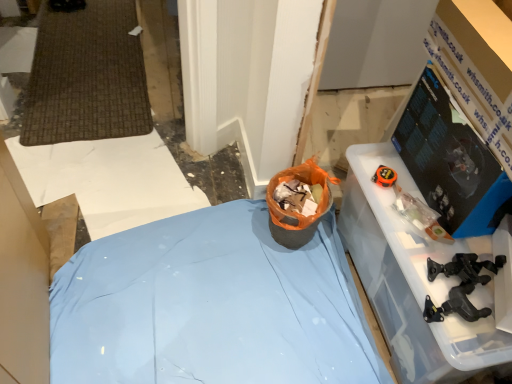
What is the approximate width of blue fabric bed at center, arranged as the first furniture when viewed from the left?

36.04 inches.

You are a GUI agent. You are given a task and a screenshot of the screen. Output one action in this format:
    pyautogui.click(x=<x>, y=<y>)
    Task: Click on the orange fabric bag at center
    This screenshot has height=384, width=512.
    Given the screenshot: What is the action you would take?
    pyautogui.click(x=294, y=212)

This screenshot has width=512, height=384. What do you see at coordinates (449, 161) in the screenshot? I see `black glossy monitor at upper right` at bounding box center [449, 161].

Locate an element on the screen. The height and width of the screenshot is (384, 512). blue fabric bed at center, arranged as the first furniture when viewed from the left is located at coordinates (210, 306).

Do you think black glossy monitor at upper right is within blue fabric bed at center, arranged as the first furniture when viewed from the left, or outside of it?

black glossy monitor at upper right cannot be found inside blue fabric bed at center, arranged as the first furniture when viewed from the left.

I want to click on computer monitor located on the right of blue fabric bed at center, the 2th furniture positioned from the right, so click(449, 161).

Consider the image. Which is closer to the camera, (467, 222) or (303, 338)?

Point (467, 222)

Would you say transparent plastic container at right, which is counted as the 1th furniture, starting from the right, is outside blue fabric bed at center, arranged as the first furniture when viewed from the left?

Indeed, transparent plastic container at right, which is counted as the 1th furniture, starting from the right, is completely outside blue fabric bed at center, arranged as the first furniture when viewed from the left.

Is the position of transparent plastic container at right, which is counted as the 1th furniture, starting from the right, more distant than that of blue fabric bed at center, the 2th furniture positioned from the right?

No, it is not.

From the image's perspective, is transparent plastic container at right, which is counted as the 1th furniture, starting from the right, above or below blue fabric bed at center, the 2th furniture positioned from the right?

transparent plastic container at right, which is counted as the 1th furniture, starting from the right, is situated higher than blue fabric bed at center, the 2th furniture positioned from the right, in the image.

Consider the image. From the image's perspective, relative to black plastic tool at lower right, is transparent plastic container at right, arranged as the 2th furniture when viewed from the left, above or below?

transparent plastic container at right, arranged as the 2th furniture when viewed from the left, is above black plastic tool at lower right.

Is black plastic tool at lower right located within transparent plastic container at right, arranged as the 2th furniture when viewed from the left?

Definitely not — black plastic tool at lower right is not inside transparent plastic container at right, arranged as the 2th furniture when viewed from the left.

Based on their sizes in the image, would you say transparent plastic container at right, arranged as the 2th furniture when viewed from the left, is bigger or smaller than black plastic tool at lower right?

Considering their sizes, transparent plastic container at right, arranged as the 2th furniture when viewed from the left, takes up more space than black plastic tool at lower right.

Could you tell me if transparent plastic container at right, arranged as the 2th furniture when viewed from the left, is turned towards black plastic tool at lower right?

No.

Considering the relative sizes of orange fabric bag at center and black plastic tool at lower right in the image provided, is orange fabric bag at center wider than black plastic tool at lower right?

Indeed, orange fabric bag at center has a greater width compared to black plastic tool at lower right.

Looking at this image, is orange fabric bag at center next to black plastic tool at lower right?

There is a gap between orange fabric bag at center and black plastic tool at lower right.

What are the coordinates of `tool located below the orange fabric bag at center (from the image's perspective)` in the screenshot? It's located at (460, 286).

Is orange fabric bag at center facing towards transparent plastic container at right, which is counted as the 1th furniture, starting from the right?

No.

Is orange fabric bag at center spatially inside transparent plastic container at right, which is counted as the 1th furniture, starting from the right, or outside of it?

orange fabric bag at center is outside transparent plastic container at right, which is counted as the 1th furniture, starting from the right.

Is point (289, 211) closer to camera compared to point (412, 293)?

No, it is behind (412, 293).

Can you see orange fabric bag at center touching transparent plastic container at right, which is counted as the 1th furniture, starting from the right?

No, orange fabric bag at center is not in contact with transparent plastic container at right, which is counted as the 1th furniture, starting from the right.

Is blue fabric bed at center, the 2th furniture positioned from the right, beside black glossy monitor at upper right?

No, blue fabric bed at center, the 2th furniture positioned from the right, is not in contact with black glossy monitor at upper right.

From a real-world perspective, is blue fabric bed at center, the 2th furniture positioned from the right, over black glossy monitor at upper right?

No, from a real-world perspective, blue fabric bed at center, the 2th furniture positioned from the right, is not on top of black glossy monitor at upper right.

Does blue fabric bed at center, the 2th furniture positioned from the right, have a smaller size compared to black glossy monitor at upper right?

Incorrect, blue fabric bed at center, the 2th furniture positioned from the right, is not smaller in size than black glossy monitor at upper right.

From the image's perspective, is transparent plastic container at right, which is counted as the 1th furniture, starting from the right, under black glossy monitor at upper right?

Indeed, from the image's perspective, transparent plastic container at right, which is counted as the 1th furniture, starting from the right, is shown beneath black glossy monitor at upper right.

Considering the sizes of objects transparent plastic container at right, arranged as the 2th furniture when viewed from the left, and black glossy monitor at upper right in the image provided, who is taller, transparent plastic container at right, arranged as the 2th furniture when viewed from the left, or black glossy monitor at upper right?

transparent plastic container at right, arranged as the 2th furniture when viewed from the left, is taller.

Can you tell me how much transparent plastic container at right, arranged as the 2th furniture when viewed from the left, and black glossy monitor at upper right differ in facing direction?

The facing directions of transparent plastic container at right, arranged as the 2th furniture when viewed from the left, and black glossy monitor at upper right are 92.5 degrees apart.

Is black glossy monitor at upper right inside transparent plastic container at right, arranged as the 2th furniture when viewed from the left?

No, transparent plastic container at right, arranged as the 2th furniture when viewed from the left, does not contain black glossy monitor at upper right.

In order to click on computer monitor above the blue fabric bed at center, arranged as the first furniture when viewed from the left (from a real-world perspective) in this screenshot , I will do `click(449, 161)`.

Where is `furniture that is behind the transparent plastic container at right, arranged as the 2th furniture when viewed from the left`? The height and width of the screenshot is (384, 512). furniture that is behind the transparent plastic container at right, arranged as the 2th furniture when viewed from the left is located at coordinates (210, 306).

Estimate the real-world distances between objects in this image. Which object is further from black plastic tool at lower right, transparent plastic container at right, which is counted as the 1th furniture, starting from the right, or orange fabric bag at center?

orange fabric bag at center is positioned further to the anchor black plastic tool at lower right.

From the image, which object appears to be nearer to black glossy monitor at upper right, orange fabric bag at center or black plastic tool at lower right?

The object closer to black glossy monitor at upper right is black plastic tool at lower right.

Based on their spatial positions, is blue fabric bed at center, arranged as the first furniture when viewed from the left, or black glossy monitor at upper right closer to orange fabric bag at center?

blue fabric bed at center, arranged as the first furniture when viewed from the left.

When comparing their distances from orange fabric bag at center, does black glossy monitor at upper right or blue fabric bed at center, the 2th furniture positioned from the right, seem closer?

Based on the image, blue fabric bed at center, the 2th furniture positioned from the right, appears to be nearer to orange fabric bag at center.

Which object lies nearer to the anchor point blue fabric bed at center, the 2th furniture positioned from the right, transparent plastic container at right, arranged as the 2th furniture when viewed from the left, or orange fabric bag at center?

orange fabric bag at center.

Looking at the image, which one is located closer to blue fabric bed at center, the 2th furniture positioned from the right, black plastic tool at lower right or black glossy monitor at upper right?

black plastic tool at lower right.

Based on their spatial positions, is black plastic tool at lower right or orange fabric bag at center closer to blue fabric bed at center, arranged as the first furniture when viewed from the left?

orange fabric bag at center is positioned closer to the anchor blue fabric bed at center, arranged as the first furniture when viewed from the left.

Which object lies nearer to the anchor point black glossy monitor at upper right, transparent plastic container at right, arranged as the 2th furniture when viewed from the left, or blue fabric bed at center, arranged as the first furniture when viewed from the left?

Among the two, transparent plastic container at right, arranged as the 2th furniture when viewed from the left, is located nearer to black glossy monitor at upper right.

I want to click on tool between transparent plastic container at right, arranged as the 2th furniture when viewed from the left, and orange fabric bag at center, along the z-axis, so click(x=460, y=286).

This screenshot has width=512, height=384. What are the coordinates of `furniture between black glossy monitor at upper right and black plastic tool at lower right in the vertical direction` in the screenshot? It's located at (411, 279).

Where is `garbage between blue fabric bed at center, the 2th furniture positioned from the right, and transparent plastic container at right, which is counted as the 1th furniture, starting from the right, in the horizontal direction`? The height and width of the screenshot is (384, 512). garbage between blue fabric bed at center, the 2th furniture positioned from the right, and transparent plastic container at right, which is counted as the 1th furniture, starting from the right, in the horizontal direction is located at coordinates (294, 212).

I want to click on tool between orange fabric bag at center and black glossy monitor at upper right in the horizontal direction, so click(x=460, y=286).